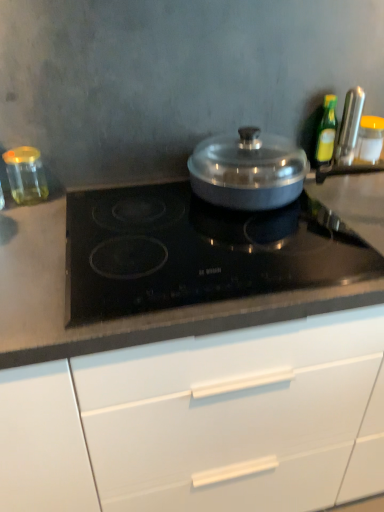
Question: Is transparent glass jar at left, the first kitchen appliance in the left-to-right sequence, taller or shorter than yellow lid glass jar at right, the 4th kitchen appliance viewed from the left?

Choices:
 (A) tall
 (B) short

Answer: (B)

Question: Based on their sizes in the image, would you say transparent glass jar at left, the first kitchen appliance in the left-to-right sequence, is bigger or smaller than yellow lid glass jar at right, which ranks as the first kitchen appliance in right-to-left order?

Choices:
 (A) small
 (B) big

Answer: (A)

Question: Based on their relative distances, which object is nearer to the green glass bottle at upper right, positioned as the 3th kitchen appliance in right-to-left order?

Choices:
 (A) white matte cabinet at center
 (B) transparent glass jar at left, the first kitchen appliance in the left-to-right sequence
 (C) yellow lid glass jar at right, which ranks as the first kitchen appliance in right-to-left order
 (D) black glass cooktop at center
 (E) metallic silver knife at upper right, which is counted as the third kitchen appliance, starting from the left

Answer: (E)

Question: Estimate the real-world distances between objects in this image. Which object is closer to the metallic silver knife at upper right, the 2th kitchen appliance viewed from the right?

Choices:
 (A) green glass bottle at upper right, marked as the second kitchen appliance in a left-to-right arrangement
 (B) transparent glass jar at left, the first kitchen appliance in the left-to-right sequence
 (C) white matte cabinet at center
 (D) yellow lid glass jar at right, the 4th kitchen appliance viewed from the left
 (E) black glass cooktop at center

Answer: (A)